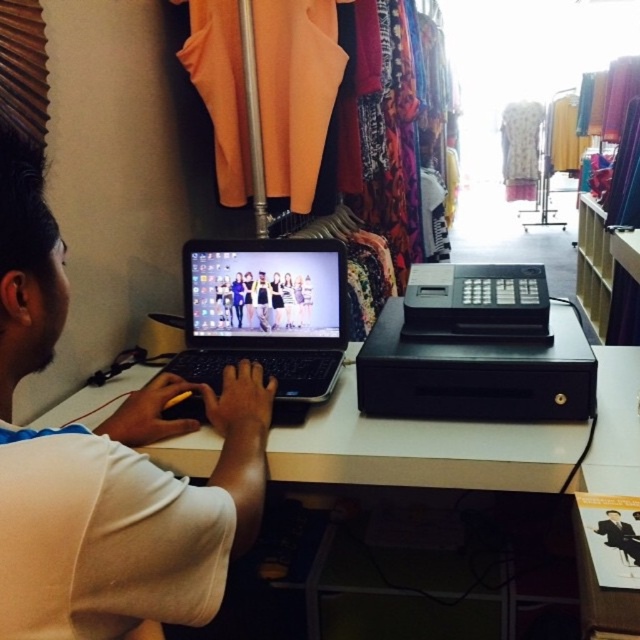
Question: In this image, where is black matte laptop at center located relative to smooth black suit at center?

Choices:
 (A) right
 (B) left

Answer: (B)

Question: Which object is closer to the camera taking this photo?

Choices:
 (A) white matte table at center
 (B) smooth black suit at center
 (C) white matte laptop at center

Answer: (C)

Question: Which of the following is the farthest from the observer?

Choices:
 (A) smooth black suit at center
 (B) matte black laptop at center
 (C) black matte laptop at center

Answer: (B)

Question: Which point is closer to the camera taking this photo?

Choices:
 (A) (529, 349)
 (B) (259, 320)

Answer: (A)

Question: Is white matte laptop at center to the right of white matte table at center from the viewer's perspective?

Choices:
 (A) no
 (B) yes

Answer: (A)

Question: Does white matte table at center have a lesser width compared to matte black laptop at center?

Choices:
 (A) no
 (B) yes

Answer: (A)